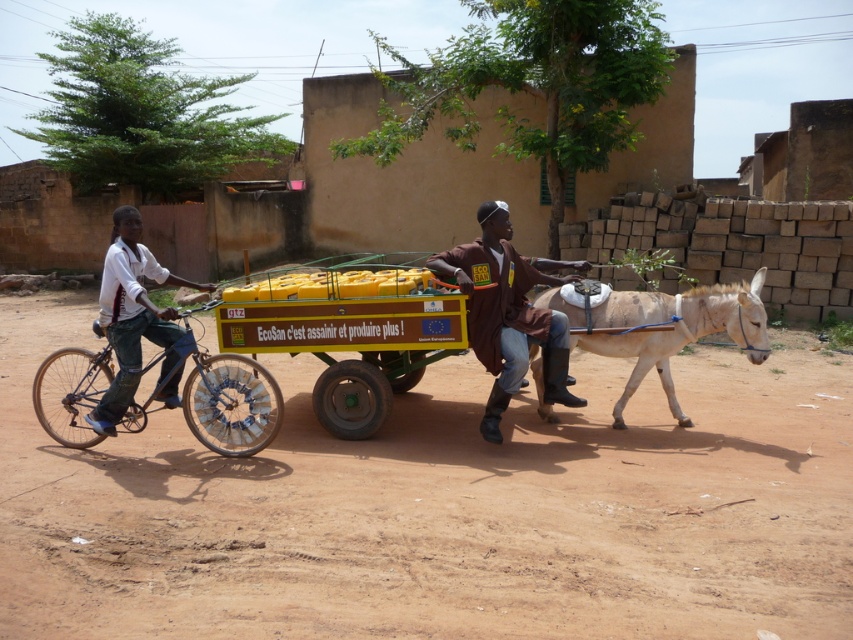
Question: Among these points, which one is nearest to the camera?

Choices:
 (A) (376, 317)
 (B) (206, 420)
 (C) (148, 266)
 (D) (773, 492)

Answer: (D)

Question: Is yellow plastic cart at center below blue matte bicycle at left?

Choices:
 (A) no
 (B) yes

Answer: (A)

Question: Based on their relative distances, which object is nearer to the white shirt at left?

Choices:
 (A) brown dirt field at center
 (B) brown leather jacket at center
 (C) yellow plastic cart at center
 (D) light brown leather donkey at center

Answer: (B)

Question: Does blue matte bicycle at left have a larger size compared to brown leather jacket at center?

Choices:
 (A) no
 (B) yes

Answer: (B)

Question: Which point is closer to the camera?

Choices:
 (A) brown dirt field at center
 (B) yellow plastic cart at center
 (C) brown leather jacket at center

Answer: (A)

Question: Is brown dirt field at center to the left of brown leather jacket at center from the viewer's perspective?

Choices:
 (A) no
 (B) yes

Answer: (A)